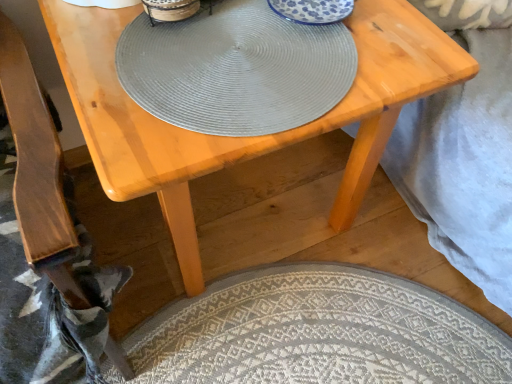
Question: From a real-world perspective, is matte gray placemat at center positioned above or below neutral woven mat at lower center?

Choices:
 (A) below
 (B) above

Answer: (B)

Question: Visually, is matte gray placemat at center positioned to the left or to the right of neutral woven mat at lower center?

Choices:
 (A) left
 (B) right

Answer: (A)

Question: Considering the real-world distances, which object is closest to the matte gray placemat at center?

Choices:
 (A) neutral woven mat at lower center
 (B) light wood table at center
 (C) wooden armchair at lower left
 (D) matte gray placemat at center

Answer: (D)

Question: Estimate the real-world distances between objects in this image. Which object is closer to the matte gray placemat at center?

Choices:
 (A) wooden armchair at lower left
 (B) matte gray placemat at center
 (C) neutral woven mat at lower center
 (D) light wood table at center

Answer: (D)